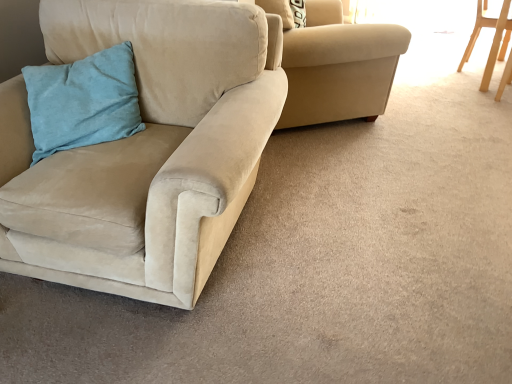
Question: From the image's perspective, is suede beige couch at left, which appears as the 3th chair when viewed from the right, located beneath teal suede pillow at left?

Choices:
 (A) yes
 (B) no

Answer: (A)

Question: Are suede beige couch at left, the 1th chair viewed from the left, and teal suede pillow at left making contact?

Choices:
 (A) no
 (B) yes

Answer: (A)

Question: From a real-world perspective, is suede beige couch at left, the 1th chair viewed from the left, located higher than teal suede pillow at left?

Choices:
 (A) no
 (B) yes

Answer: (A)

Question: Can you confirm if suede beige couch at left, which appears as the 3th chair when viewed from the right, is bigger than teal suede pillow at left?

Choices:
 (A) yes
 (B) no

Answer: (A)

Question: Is suede beige couch at left, which appears as the 3th chair when viewed from the right, shorter than teal suede pillow at left?

Choices:
 (A) no
 (B) yes

Answer: (A)

Question: Would you say suede beige couch at left, which appears as the 3th chair when viewed from the right, is outside teal suede pillow at left?

Choices:
 (A) no
 (B) yes

Answer: (B)

Question: Is suede beige couch at left, which appears as the 3th chair when viewed from the right, far away from light wood chair at upper right, which appears as the first chair when viewed from the right?

Choices:
 (A) no
 (B) yes

Answer: (B)

Question: Can you confirm if suede beige couch at left, which appears as the 3th chair when viewed from the right, is positioned to the right of light wood chair at upper right, which appears as the first chair when viewed from the right?

Choices:
 (A) yes
 (B) no

Answer: (B)

Question: Is suede beige couch at left, which appears as the 3th chair when viewed from the right, wider than light wood chair at upper right, which appears as the first chair when viewed from the right?

Choices:
 (A) yes
 (B) no

Answer: (A)

Question: Is suede beige couch at left, which appears as the 3th chair when viewed from the right, taller than light wood chair at upper right, which appears as the 3th chair when viewed from the left?

Choices:
 (A) yes
 (B) no

Answer: (A)

Question: From a real-world perspective, is suede beige couch at left, which appears as the 3th chair when viewed from the right, located beneath light wood chair at upper right, which appears as the first chair when viewed from the right?

Choices:
 (A) no
 (B) yes

Answer: (A)

Question: Considering the relative sizes of suede beige couch at left, which appears as the 3th chair when viewed from the right, and light wood chair at upper right, which appears as the first chair when viewed from the right, in the image provided, is suede beige couch at left, which appears as the 3th chair when viewed from the right, bigger than light wood chair at upper right, which appears as the first chair when viewed from the right,?

Choices:
 (A) yes
 (B) no

Answer: (A)

Question: Is the depth of suede beige armchair at upper center, the 2th chair when ordered from right to left, less than that of teal suede pillow at left?

Choices:
 (A) yes
 (B) no

Answer: (B)